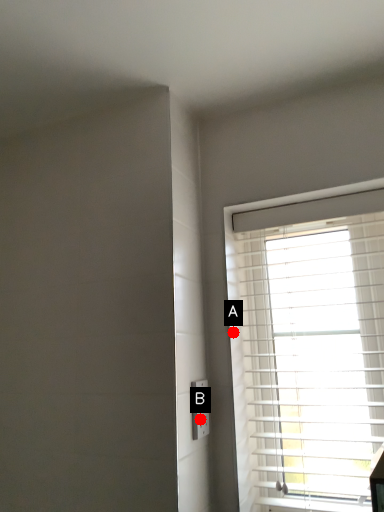
Question: Two points are circled on the image, labeled by A and B beside each circle. Which point is farther to the camera?

Choices:
 (A) A is further
 (B) B is further

Answer: (A)